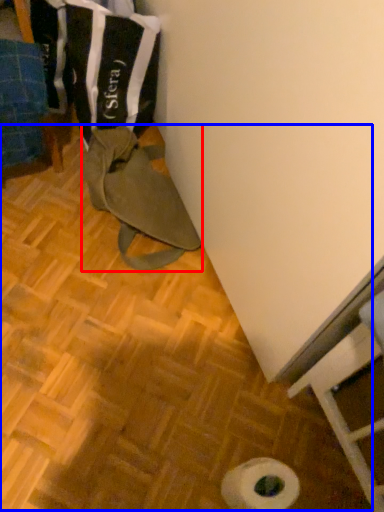
Question: Which point is further to the camera, wide (highlighted by a red box) or wood (highlighted by a blue box)?

Choices:
 (A) wide
 (B) wood

Answer: (A)